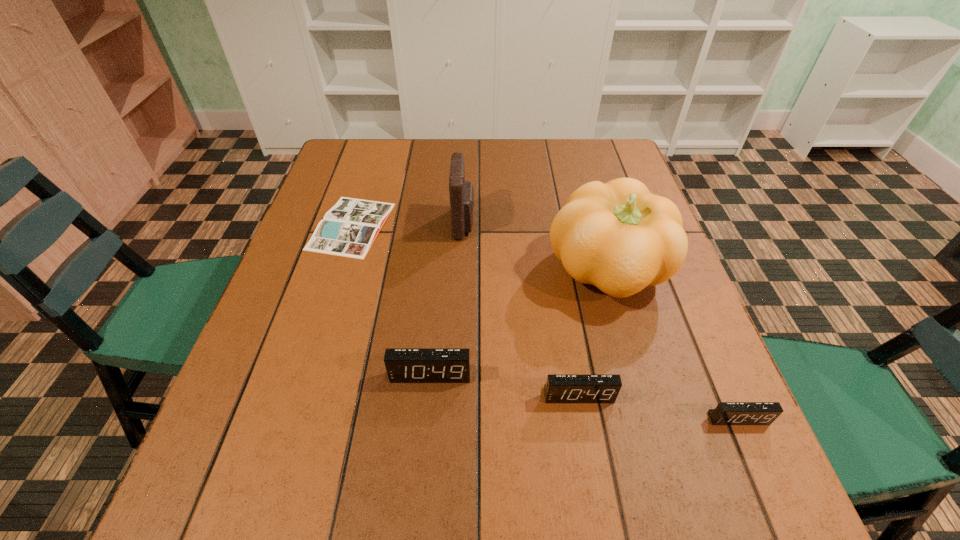
I want to click on unoccupied position between the second tallest object and the fourth tallest object, so click(521, 309).

Find the location of a particular element. This screenshot has width=960, height=540. vacant area that lies between the second tallest object and the pumpkin is located at coordinates (536, 247).

Locate an element on the screen. Image resolution: width=960 pixels, height=540 pixels. empty location between the tallest object and the leftmost alarm clock is located at coordinates pyautogui.click(x=519, y=322).

The image size is (960, 540). I want to click on vacant area that lies between the fifth farthest object and the leftmost alarm clock, so click(x=504, y=385).

Find the location of `object that is the third nearest to the pumpkin`. object that is the third nearest to the pumpkin is located at coordinates (402, 365).

Choose which object is the fifth nearest neighbor to the second tallest object. Please provide its 2D coordinates. Your answer should be formatted as a tuple, i.e. [(x, y)], where the tuple contains the x and y coordinates of a point satisfying the conditions above.

[(726, 413)]

Locate which alarm clock ranks third in proximity to the leftmost object. Please provide its 2D coordinates. Your answer should be formatted as a tuple, i.e. [(x, y)], where the tuple contains the x and y coordinates of a point satisfying the conditions above.

[(726, 413)]

The image size is (960, 540). What are the coordinates of `the closest alarm clock relative to the second alarm clock from right to left` in the screenshot? It's located at (402, 365).